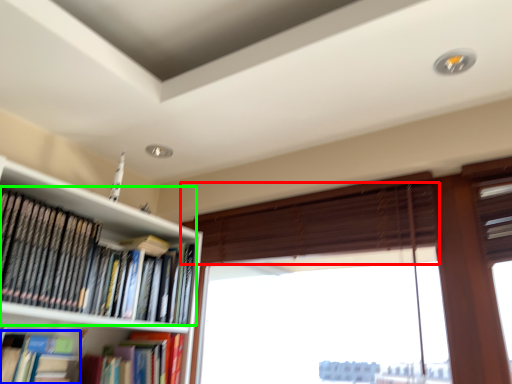
Question: Which is nearer to the blind (highlighted by a red box)? book (highlighted by a blue box) or book (highlighted by a green box).

Choices:
 (A) book
 (B) book

Answer: (B)